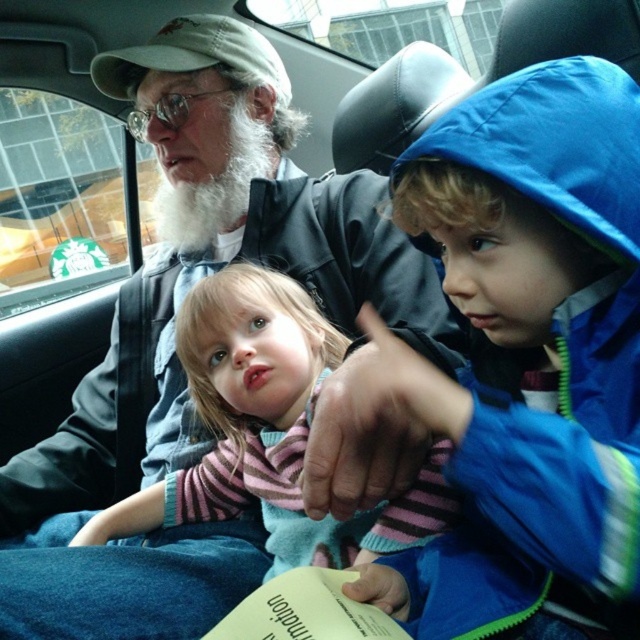
Question: From the image, what is the correct spatial relationship of blue quilted jacket at right in relation to whitewool-likebeard at center?

Choices:
 (A) above
 (B) below

Answer: (B)

Question: Can you confirm if striped sweater at center is wider than whitewool-likebeard at center?

Choices:
 (A) no
 (B) yes

Answer: (B)

Question: Which object is positioned farthest from the whitewool-likebeard at center?

Choices:
 (A) striped sweater at center
 (B) gray knit cap at upper center

Answer: (A)

Question: Which of the following is the farthest from the observer?

Choices:
 (A) blue quilted jacket at right
 (B) gray knit cap at upper center
 (C) striped sweater at center
 (D) whitewool-likebeard at center

Answer: (D)

Question: Which point is farther to the camera?

Choices:
 (A) striped sweater at center
 (B) gray knit cap at upper center
 (C) blue quilted jacket at right

Answer: (A)

Question: Does blue quilted jacket at right appear on the left side of gray knit cap at upper center?

Choices:
 (A) no
 (B) yes

Answer: (A)